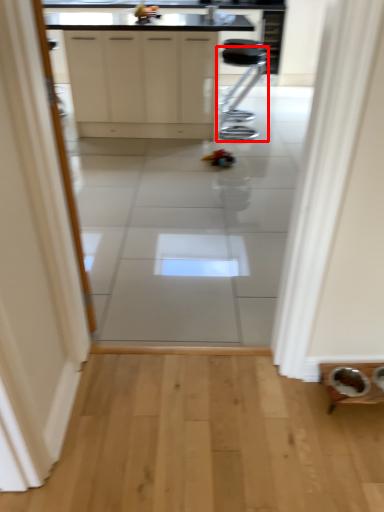
Question: From the image's perspective, where is furniture (annotated by the red box) located relative to cabinetry?

Choices:
 (A) above
 (B) below

Answer: (B)